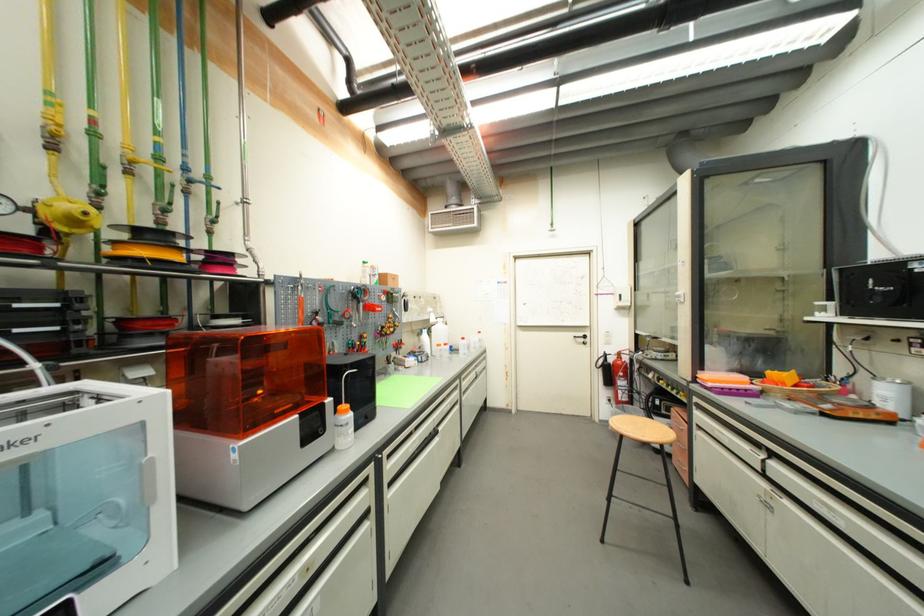
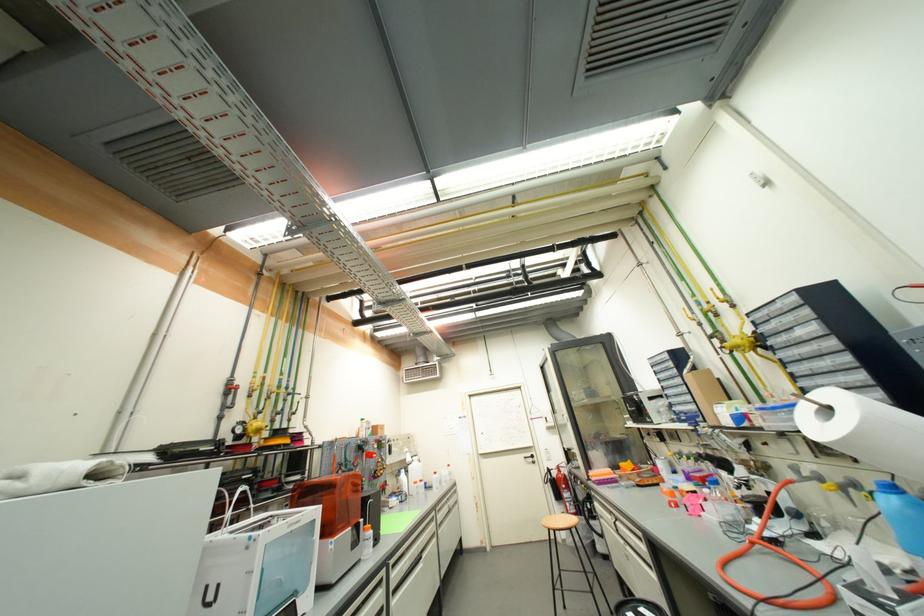
Where in the second image is the point corresponding to [580,339] from the first image?

(530, 459)